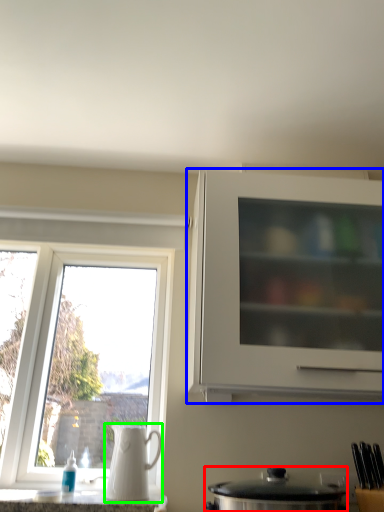
Question: Which object is the farthest from kitchen appliance (highlighted by a red box)? Choose among these: cabinetry (highlighted by a blue box) or jug (highlighted by a green box).

Choices:
 (A) cabinetry
 (B) jug

Answer: (A)